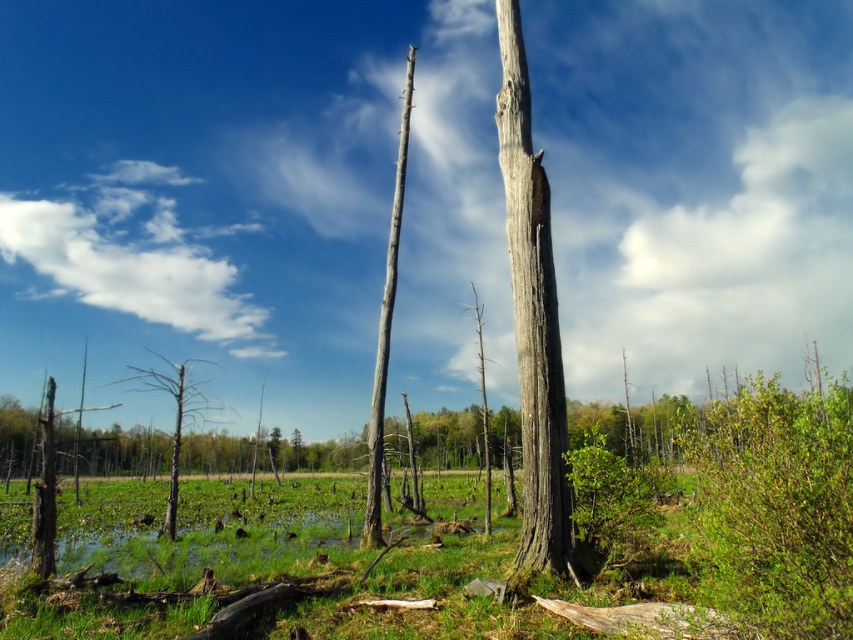
Question: Which of these objects is positioned farthest from the gray rough bark tree trunk at center?

Choices:
 (A) brown textured tree at left
 (B) gray bark tree at center

Answer: (A)

Question: Does gray bark tree at center appear on the left side of brown textured tree at left?

Choices:
 (A) no
 (B) yes

Answer: (A)

Question: Can you confirm if gray bark tree at center is positioned below brown textured tree at left?

Choices:
 (A) no
 (B) yes

Answer: (A)

Question: Among these points, which one is farthest from the camera?

Choices:
 (A) (372, 417)
 (B) (177, 396)
 (C) (509, 112)

Answer: (B)

Question: Observing the image, what is the correct spatial positioning of gray rough bark tree trunk at center in reference to gray bark tree at center?

Choices:
 (A) below
 (B) above

Answer: (B)

Question: Which object is positioned farthest from the gray bark tree at center?

Choices:
 (A) gray rough bark tree trunk at center
 (B) brown textured tree at left

Answer: (B)